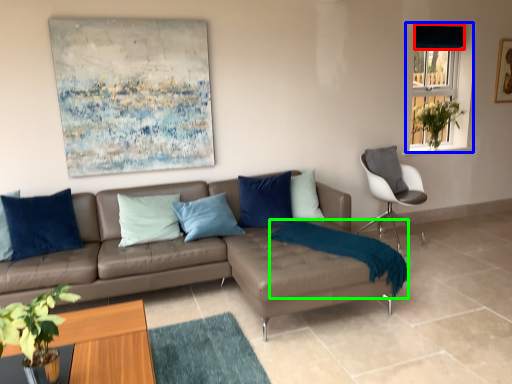
Question: Which is farther away from curtain (highlighted by a red box)? window (highlighted by a blue box) or blanket (highlighted by a green box)?

Choices:
 (A) window
 (B) blanket

Answer: (B)